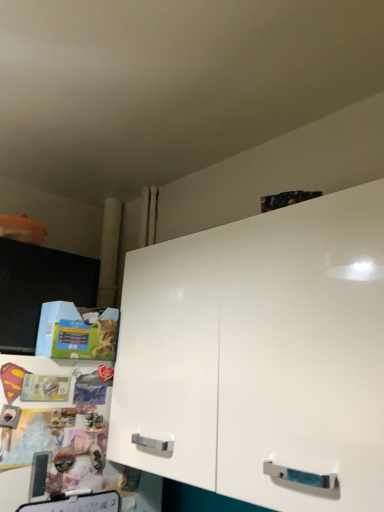
Question: Is white glossy cabinet at upper right, which ranks as the second cabinetry in left-to-right order, oriented away from black glossy cabinet at left, which is counted as the first cabinetry, starting from the left?

Choices:
 (A) no
 (B) yes

Answer: (A)

Question: From a real-world perspective, does white glossy cabinet at upper right, positioned as the 1th cabinetry in right-to-left order, stand above black glossy cabinet at left, placed as the 2th cabinetry when sorted from right to left?

Choices:
 (A) no
 (B) yes

Answer: (A)

Question: Considering the relative positions of white glossy cabinet at upper right, positioned as the 1th cabinetry in right-to-left order, and black glossy cabinet at left, placed as the 2th cabinetry when sorted from right to left, in the image provided, is white glossy cabinet at upper right, positioned as the 1th cabinetry in right-to-left order, in front of black glossy cabinet at left, placed as the 2th cabinetry when sorted from right to left,?

Choices:
 (A) yes
 (B) no

Answer: (A)

Question: Is white glossy cabinet at upper right, positioned as the 1th cabinetry in right-to-left order, surrounding black glossy cabinet at left, which is counted as the first cabinetry, starting from the left?

Choices:
 (A) no
 (B) yes

Answer: (A)

Question: Does white glossy cabinet at upper right, positioned as the 1th cabinetry in right-to-left order, have a greater width compared to black glossy cabinet at left, which is counted as the first cabinetry, starting from the left?

Choices:
 (A) yes
 (B) no

Answer: (A)

Question: Is white glossy cabinet at upper right, positioned as the 1th cabinetry in right-to-left order, not within black glossy cabinet at left, placed as the 2th cabinetry when sorted from right to left?

Choices:
 (A) no
 (B) yes

Answer: (B)

Question: Can you confirm if black glossy cabinet at left, which is counted as the first cabinetry, starting from the left, is positioned to the left of white glossy cabinet at upper right, which ranks as the second cabinetry in left-to-right order?

Choices:
 (A) yes
 (B) no

Answer: (A)

Question: Considering the relative positions of black glossy cabinet at left, which is counted as the first cabinetry, starting from the left, and white glossy cabinet at upper right, which ranks as the second cabinetry in left-to-right order, in the image provided, is black glossy cabinet at left, which is counted as the first cabinetry, starting from the left, in front of white glossy cabinet at upper right, which ranks as the second cabinetry in left-to-right order,?

Choices:
 (A) no
 (B) yes

Answer: (A)

Question: From the image's perspective, is black glossy cabinet at left, which is counted as the first cabinetry, starting from the left, on top of white glossy cabinet at upper right, positioned as the 1th cabinetry in right-to-left order?

Choices:
 (A) yes
 (B) no

Answer: (A)

Question: Is black glossy cabinet at left, which is counted as the first cabinetry, starting from the left, turned away from white glossy cabinet at upper right, positioned as the 1th cabinetry in right-to-left order?

Choices:
 (A) no
 (B) yes

Answer: (A)

Question: Does black glossy cabinet at left, which is counted as the first cabinetry, starting from the left, have a lesser height compared to white glossy cabinet at upper right, positioned as the 1th cabinetry in right-to-left order?

Choices:
 (A) yes
 (B) no

Answer: (A)

Question: Is black glossy cabinet at left, which is counted as the first cabinetry, starting from the left, touching white glossy cabinet at upper right, which ranks as the second cabinetry in left-to-right order?

Choices:
 (A) no
 (B) yes

Answer: (A)

Question: From their relative heights in the image, would you say black glossy cabinet at left, placed as the 2th cabinetry when sorted from right to left, is taller or shorter than white glossy cabinet at upper right, which ranks as the second cabinetry in left-to-right order?

Choices:
 (A) short
 (B) tall

Answer: (A)